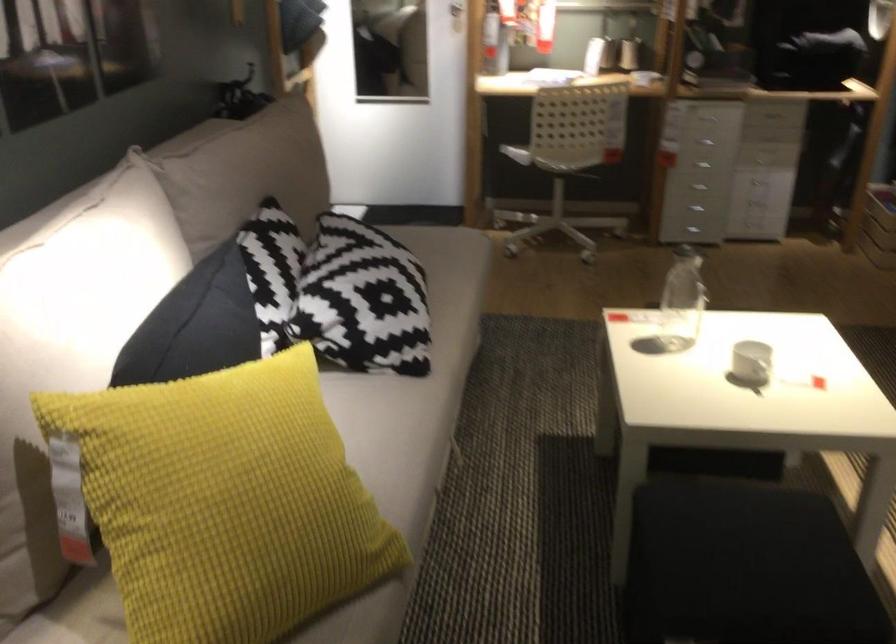
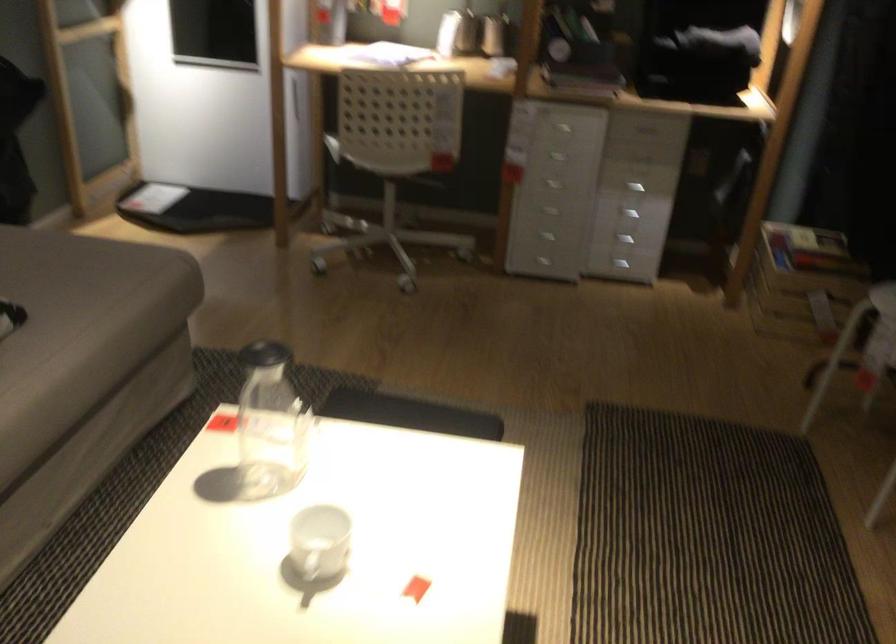
In the second image, find the point that corresponds to [771,194] in the first image.

(625, 240)